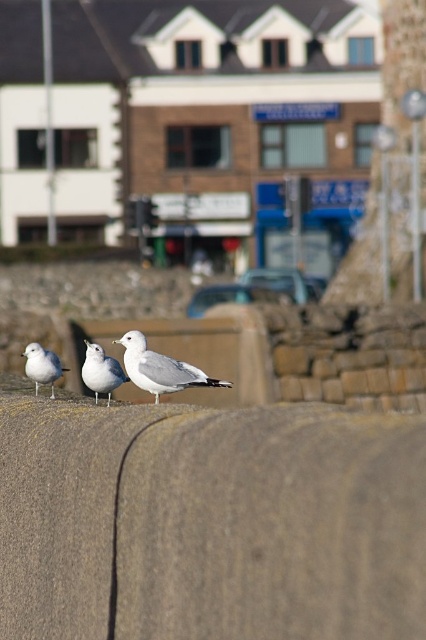
You are a photographer trying to capture the white feathered seagull at center in your shot. The gray concrete wall at center is blocking part of the view. Can you estimate if the wall is bigger than the seagull?

The gray concrete wall at center is larger in size than white feathered seagull at center, so yes, the wall is bigger than the seagull.

You are standing at the waterfront and notice two points marked in the scene. The first point is at coordinate point (175, 385) and the second is at point (85, 368). Which point is closer to you?

Point (175, 385) is closer to the viewer than point (85, 368).